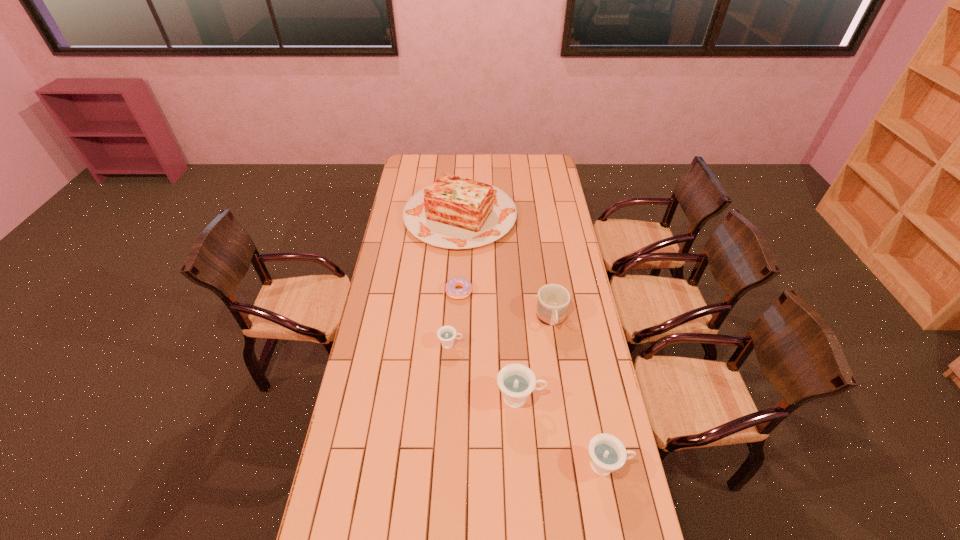
This screenshot has width=960, height=540. What are the coordinates of `the fifth tallest object` in the screenshot? It's located at (447, 334).

Identify the location of the leftmost teacup. The image size is (960, 540). (447, 334).

At what (x,y) coordinates should I click in order to perform the action: click on the second teacup from left to right. Please return your answer as a coordinate pair (x, y). Looking at the image, I should click on (516, 381).

Where is `the second nearest object`? The height and width of the screenshot is (540, 960). the second nearest object is located at coordinates (516, 381).

Identify the location of the nearest object. This screenshot has height=540, width=960. (607, 453).

The image size is (960, 540). Find the location of `the third shortest object`. the third shortest object is located at coordinates point(607,453).

Where is `the tallest object`? Image resolution: width=960 pixels, height=540 pixels. the tallest object is located at coordinates (455, 213).

You are a GUI agent. You are given a task and a screenshot of the screen. Output one action in this format:
    pyautogui.click(x=<x>, y=<y>)
    Task: Click on the lasagna
    
    Given the screenshot: What is the action you would take?
    pyautogui.click(x=455, y=213)

What are the coordinates of `the shortest object` in the screenshot? It's located at (451, 291).

Locate an element on the screen. Image resolution: width=960 pixels, height=540 pixels. the second farthest object is located at coordinates (451, 291).